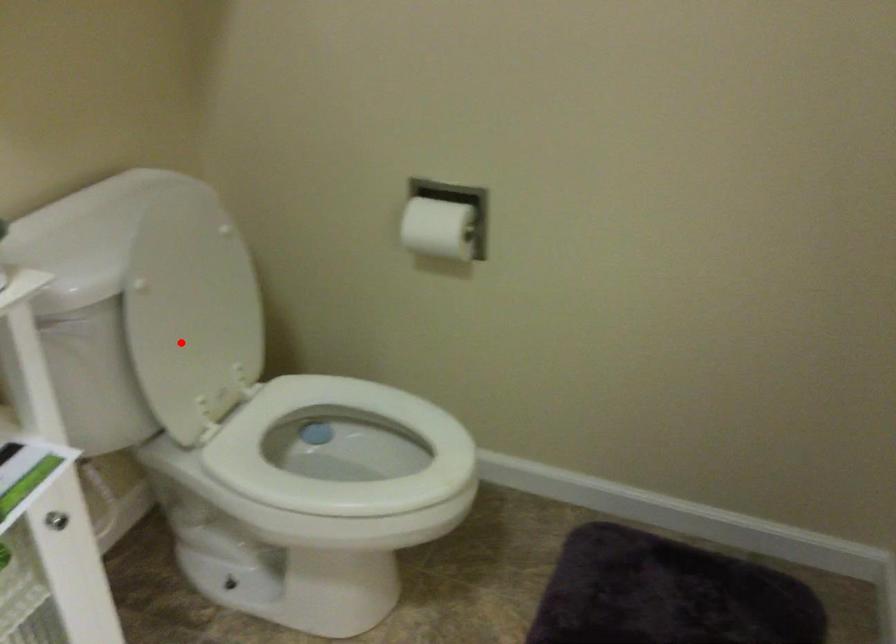
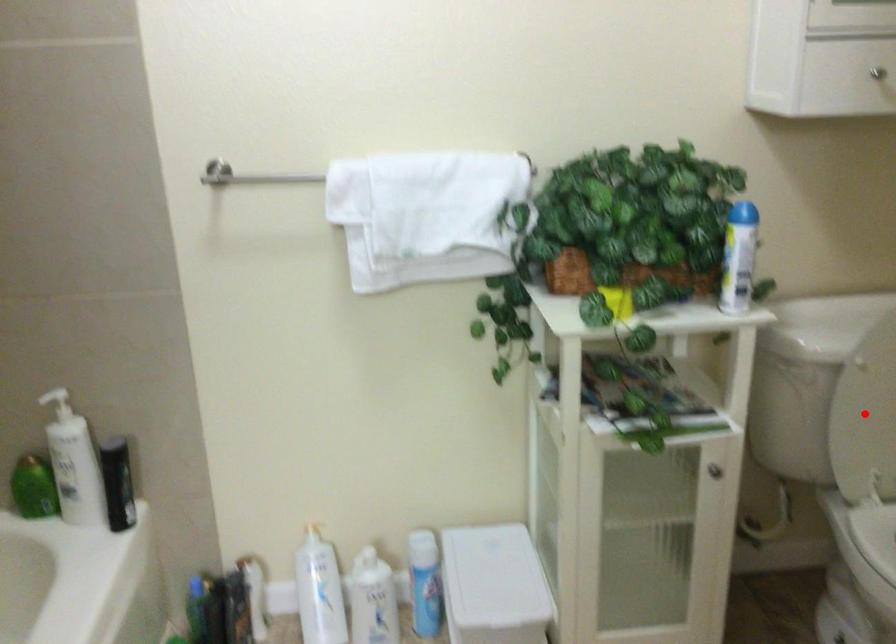
I am providing you with two images of the same scene from different viewpoints. A red point is marked on the first image and another point is marked on the second image. Are the points marked in image1 and image2 representing the same 3D position?

Yes